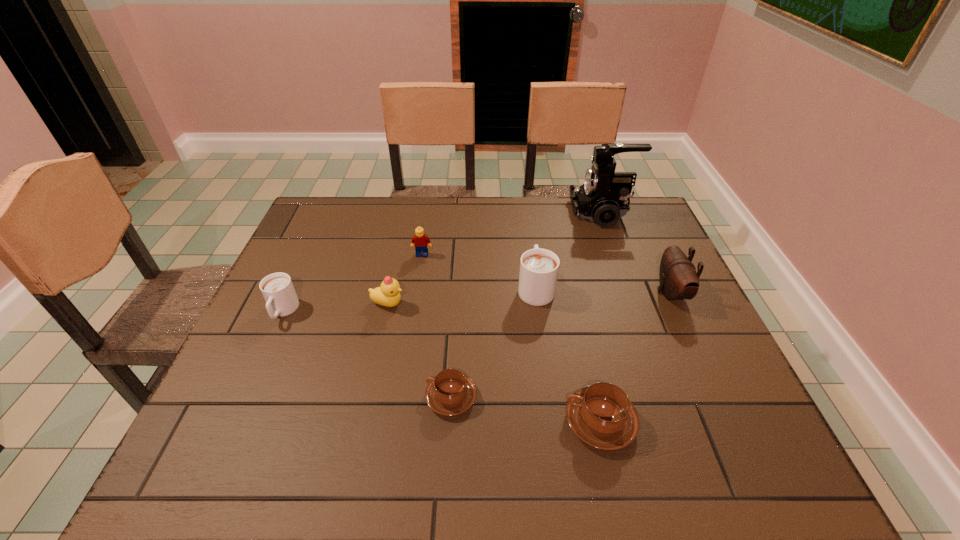
At what (x,y) coordinates should I click in order to perform the action: click on camcorder. Please return your answer as a coordinate pair (x, y). Looking at the image, I should click on (603, 197).

At what (x,y) coordinates should I click in order to perform the action: click on the tallest object. Please return your answer as a coordinate pair (x, y). Looking at the image, I should click on (603, 197).

Where is `brown pouch`? This screenshot has height=540, width=960. brown pouch is located at coordinates (678, 278).

Where is `the right white cappuccino`? the right white cappuccino is located at coordinates (539, 268).

Find the location of a particular element. This screenshot has width=960, height=540. the bigger white cappuccino is located at coordinates (539, 268).

Find the location of `the seventh nearest object`. the seventh nearest object is located at coordinates (419, 241).

Find the location of a particular element. The height and width of the screenshot is (540, 960). Lego is located at coordinates (419, 241).

The width and height of the screenshot is (960, 540). I want to click on duckling, so click(388, 294).

You are a GUI agent. You are given a task and a screenshot of the screen. Output one action in this format:
    pyautogui.click(x=<x>, y=<y>)
    Task: Click on the smaller white cappuccino
    The width and height of the screenshot is (960, 540).
    Given the screenshot: What is the action you would take?
    pyautogui.click(x=278, y=291)

Locate an element on the screen. The width and height of the screenshot is (960, 540). the leftmost object is located at coordinates (278, 291).